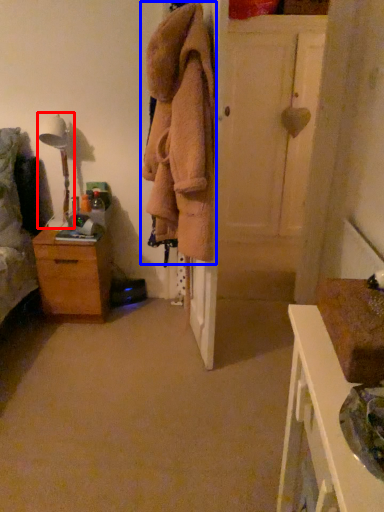
Question: Which object appears closest to the camera in this image, table lamp (highlighted by a red box) or clothing (highlighted by a blue box)?

Choices:
 (A) table lamp
 (B) clothing

Answer: (B)